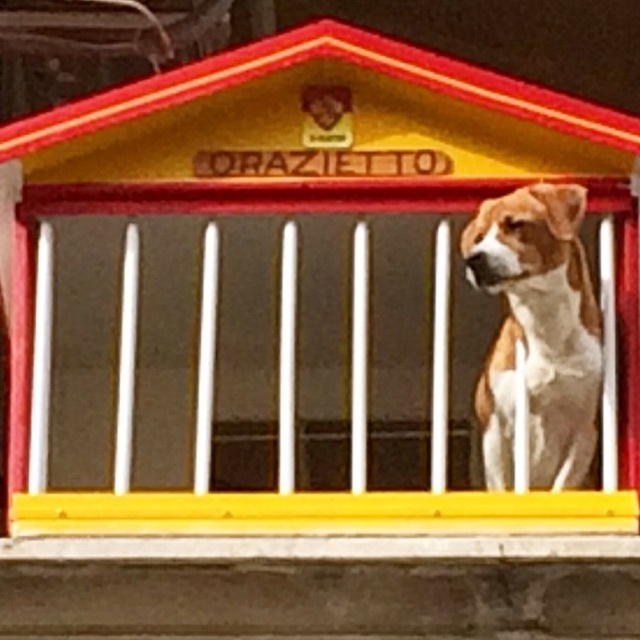
You are standing in front of the yellow matte porch at center and want to see the brown and white fur dog at right. Since the porch is larger, does it block your view of the dog?

The yellow matte porch at center is larger in size than the brown and white fur dog at right, but the dog is positioned at the right side, so the porch does not block the view of the dog.

You are standing in front of the miniature house and want to locate two specific points marked on its structure. The first point is at coordinates point (x=116, y=413) and the second is at point (x=502, y=240). From your vantage point, which of these two points is closer to you?

Point (x=502, y=240) is closer to you because it is in front of point (x=116, y=413).

You are a visitor approaching the yellow matte porch at center and notice the brown and white fur dog at right. From your perspective, which object is closer to you?

The yellow matte porch at center is closer to you because the brown and white fur dog at right is behind it.